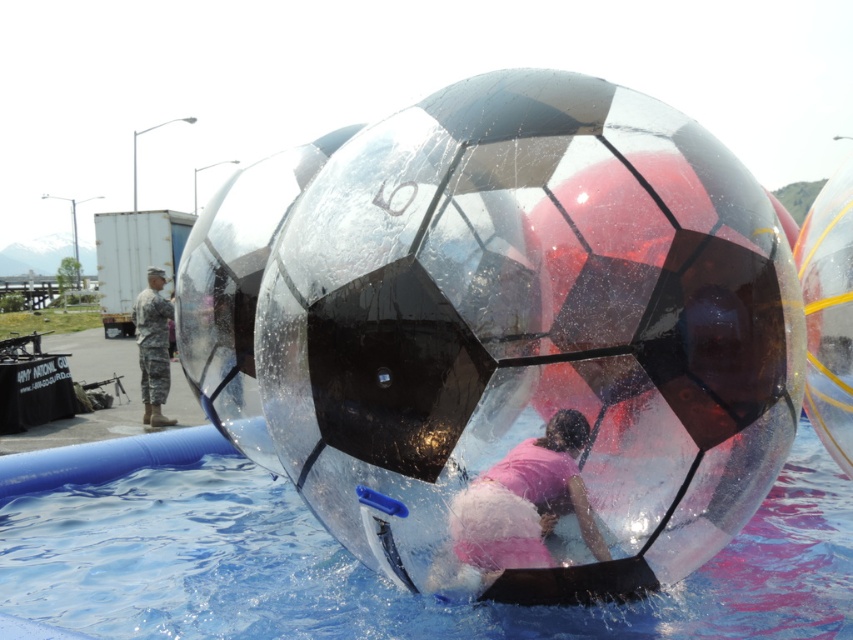
Question: Can you confirm if transparent plastic pool at center is smaller than pink matte shirt at center?

Choices:
 (A) yes
 (B) no

Answer: (B)

Question: Does transparent plastic beach ball at center have a larger size compared to transparent plastic pool at center?

Choices:
 (A) no
 (B) yes

Answer: (A)

Question: Which object is closer to the camera taking this photo?

Choices:
 (A) pink matte shirt at center
 (B) transparent plastic beach ball at center

Answer: (B)

Question: Which of these objects is positioned closest to the camouflage uniform at left?

Choices:
 (A) pink matte shirt at center
 (B) transparent plastic beach ball at center

Answer: (B)

Question: Which point is closer to the camera?

Choices:
 (A) (544, 561)
 (B) (161, 298)
 (C) (490, 618)
 (D) (645, 488)

Answer: (D)

Question: Does pink matte shirt at center lie behind camouflage uniform at left?

Choices:
 (A) no
 (B) yes

Answer: (A)